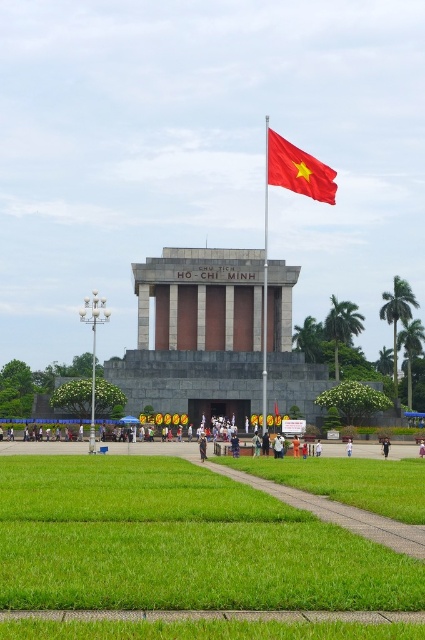
Does green grass at center have a larger size compared to black fabric person at center?

Indeed, green grass at center has a larger size compared to black fabric person at center.

Does green grass at center have a smaller size compared to black fabric person at center?

Incorrect, green grass at center is not smaller in size than black fabric person at center.

Does point (161, 545) come in front of point (206, 449)?

That is True.

At what (x,y) coordinates should I click in order to perform the action: click on green grass at center. Please return your answer as a coordinate pair (x, y). This screenshot has width=425, height=640. Looking at the image, I should click on (178, 541).

Can you confirm if black fabric person at center is positioned below white cotton shirt at center?

Incorrect, black fabric person at center is not positioned below white cotton shirt at center.

Who is more distant from viewer, (201, 451) or (351, 442)?

The point (351, 442) is more distant.

Is point (204, 449) positioned after point (351, 444)?

No, (204, 449) is closer to viewer.

Locate an element on the screen. The image size is (425, 640). black fabric person at center is located at coordinates (203, 445).

Who is more distant from viewer, [283,150] or [385,442]?

Positioned behind is point [283,150].

Is point (331, 168) farther from viewer compared to point (384, 444)?

Yes, point (331, 168) is farther from viewer.

Where is `red fabric flag at upper center`? The height and width of the screenshot is (640, 425). red fabric flag at upper center is located at coordinates (297, 170).